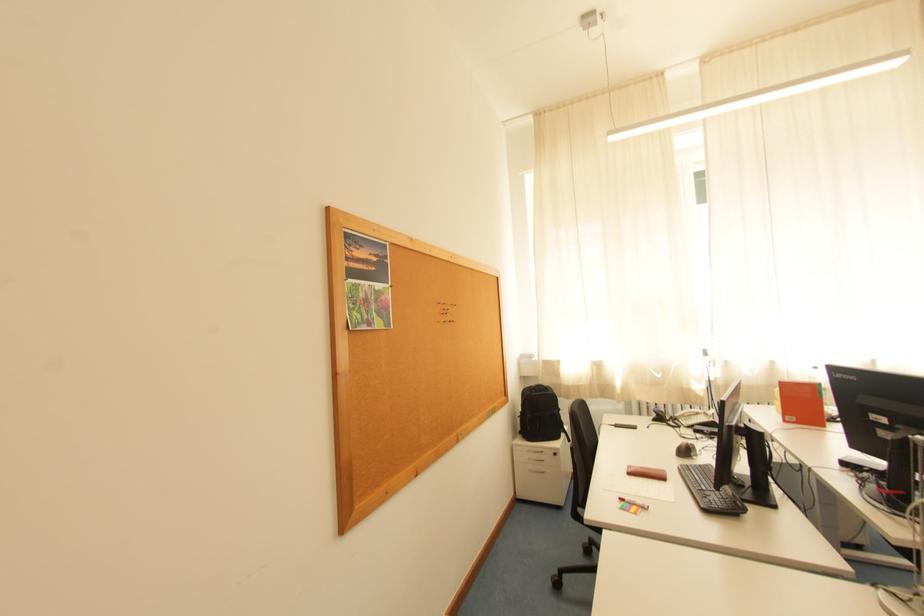
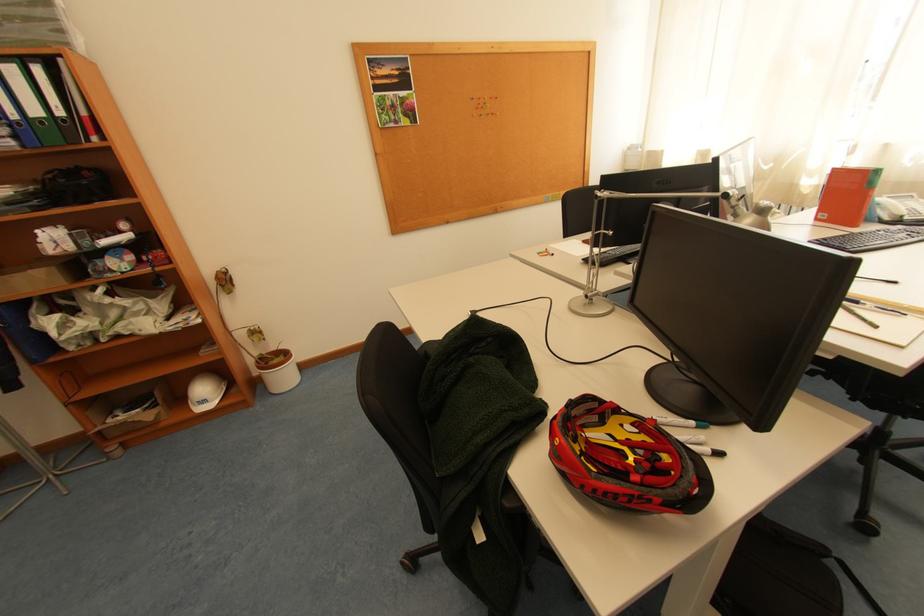
Locate, in the second image, the point that corresponds to pixel 446 323 in the first image.

(481, 118)